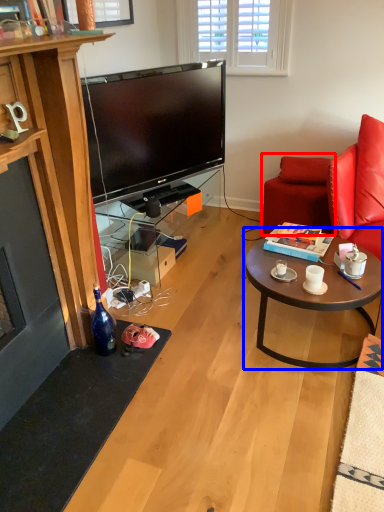
Question: Which point is further to the camera, swivel chair (highlighted by a red box) or coffee table (highlighted by a blue box)?

Choices:
 (A) swivel chair
 (B) coffee table

Answer: (A)